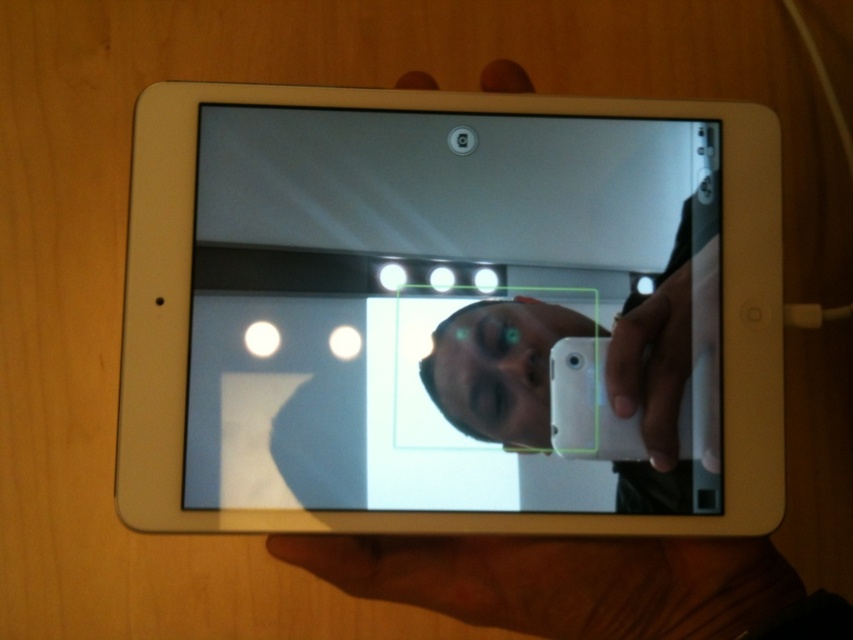
Question: Which object appears closest to the camera in this image?

Choices:
 (A) brown leather hand at lower center
 (B) white plastic tablet at center

Answer: (B)

Question: Does white plastic tablet at center have a smaller size compared to brown leather hand at lower center?

Choices:
 (A) yes
 (B) no

Answer: (B)

Question: Can you confirm if white plastic tablet at center is wider than brown leather hand at lower center?

Choices:
 (A) yes
 (B) no

Answer: (A)

Question: Which object is farther from the camera taking this photo?

Choices:
 (A) brown leather hand at lower center
 (B) white plastic tablet at center

Answer: (A)

Question: Which of the following is the closest to the observer?

Choices:
 (A) (340, 566)
 (B) (425, 116)

Answer: (A)

Question: Can you confirm if white plastic tablet at center is positioned above brown leather hand at lower center?

Choices:
 (A) yes
 (B) no

Answer: (A)